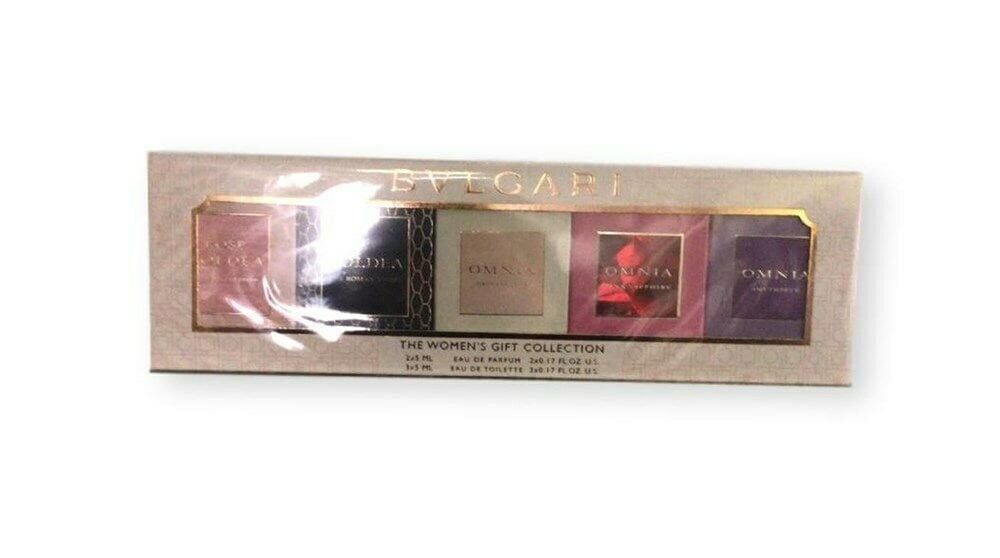
The width and height of the screenshot is (1000, 558). Find the location of `box`. box is located at coordinates (799, 365).